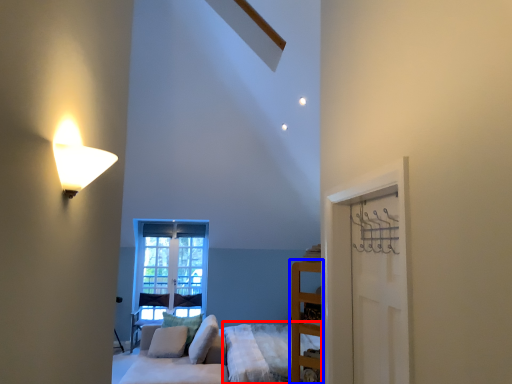
Question: Which of the following is the closest to the observer, bed frame (highlighted by a red box) or furniture (highlighted by a blue box)?

Choices:
 (A) bed frame
 (B) furniture

Answer: (B)